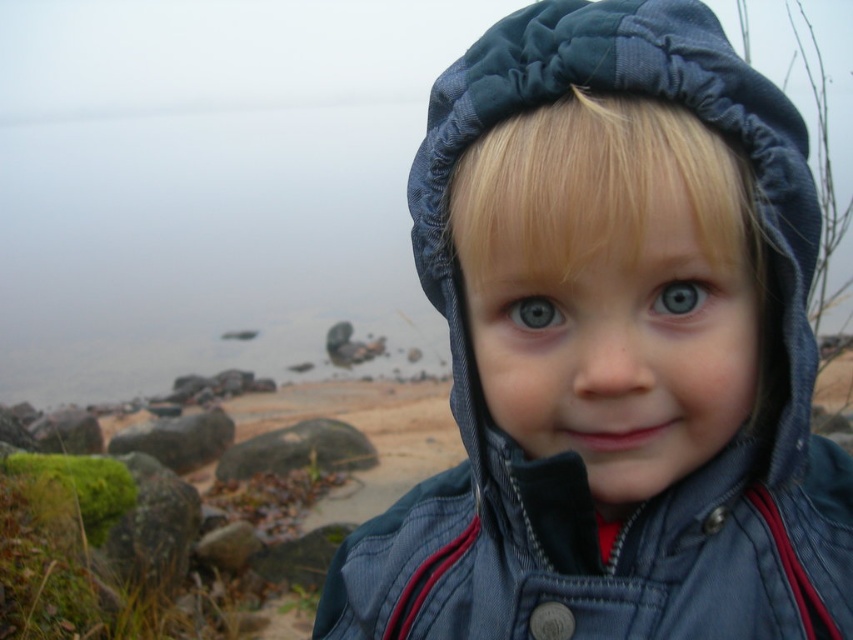
Question: Which point appears closest to the camera in this image?

Choices:
 (A) (151, 452)
 (B) (659, 301)
 (C) (796, 220)

Answer: (B)

Question: Can you confirm if green mossy rock at center is positioned above blue matte eye at center?

Choices:
 (A) no
 (B) yes

Answer: (A)

Question: Can you confirm if denim jacket at center is positioned above smooth gray rock at lower left?

Choices:
 (A) yes
 (B) no

Answer: (A)

Question: Does denim jacket at center have a larger size compared to blue matte eye at center?

Choices:
 (A) no
 (B) yes

Answer: (B)

Question: Which of these objects is positioned closest to the smooth gray rock at lower left?

Choices:
 (A) blue glossy eye at center
 (B) blue matte eye at center

Answer: (A)

Question: Estimate the real-world distances between objects in this image. Which object is closer to the green mossy rock at center?

Choices:
 (A) smooth gray rock at lower left
 (B) denim jacket at center
 (C) blue matte eye at center
 (D) blue glossy eye at center

Answer: (A)